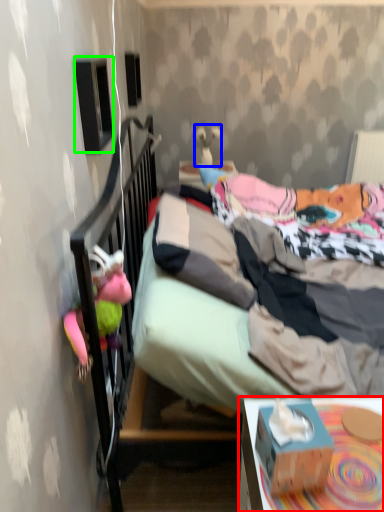
Question: Considering the real-world distances, which object is closest to desk (highlighted by a red box)? toy (highlighted by a blue box) or loudspeaker (highlighted by a green box).

Choices:
 (A) toy
 (B) loudspeaker

Answer: (B)